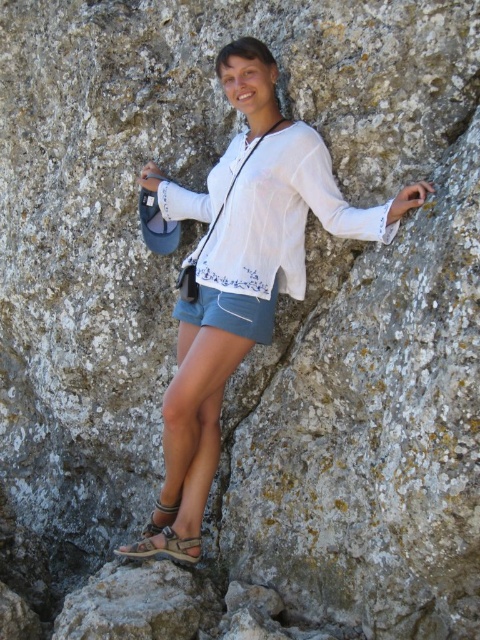
Can you confirm if denim shorts at center is positioned to the right of matte white blouse at center?

No, denim shorts at center is not to the right of matte white blouse at center.

Can you confirm if denim shorts at center is positioned to the left of matte white blouse at center?

Yes, denim shorts at center is to the left of matte white blouse at center.

Is point (208, 292) positioned behind point (264, 49)?

Yes, it is.

Locate an element on the screen. The width and height of the screenshot is (480, 640). denim shorts at center is located at coordinates click(230, 312).

Is white sheer blouse at center to the left of denim shorts at center from the viewer's perspective?

Incorrect, white sheer blouse at center is not on the left side of denim shorts at center.

Can you confirm if white sheer blouse at center is thinner than denim shorts at center?

Incorrect, white sheer blouse at center's width is not less than denim shorts at center's.

Find the location of a particular element. The width and height of the screenshot is (480, 640). white sheer blouse at center is located at coordinates (268, 196).

The height and width of the screenshot is (640, 480). Identify the location of white sheer blouse at center. (268, 196).

Which is behind, point (180, 396) or point (157, 532)?

The point (157, 532) is behind.

Who is higher up, white sheer blouse at center or brown leather sandal at lower center?

white sheer blouse at center is above.

Which is in front, point (204, 502) or point (149, 531)?

Point (204, 502) is in front.

In order to click on white sheer blouse at center in this screenshot , I will do `click(268, 196)`.